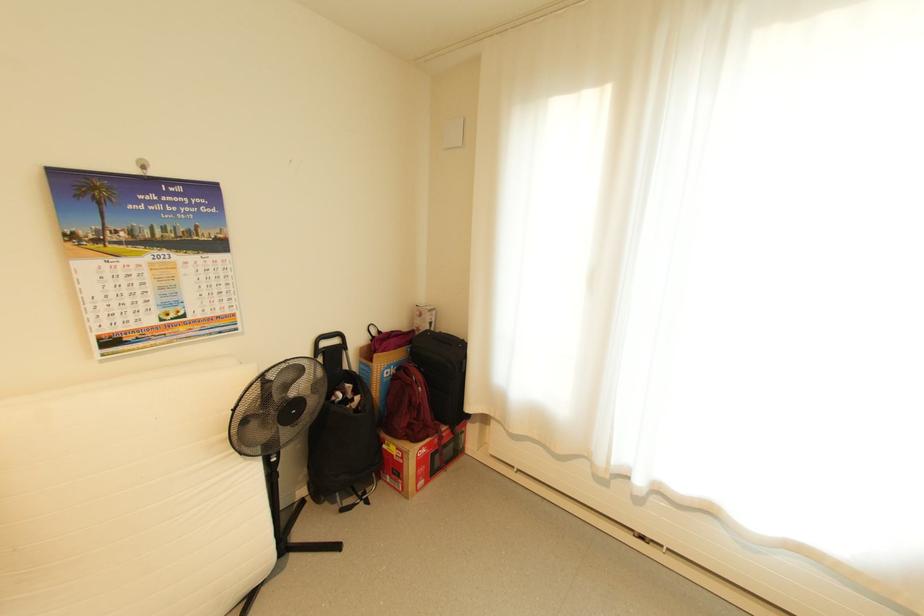
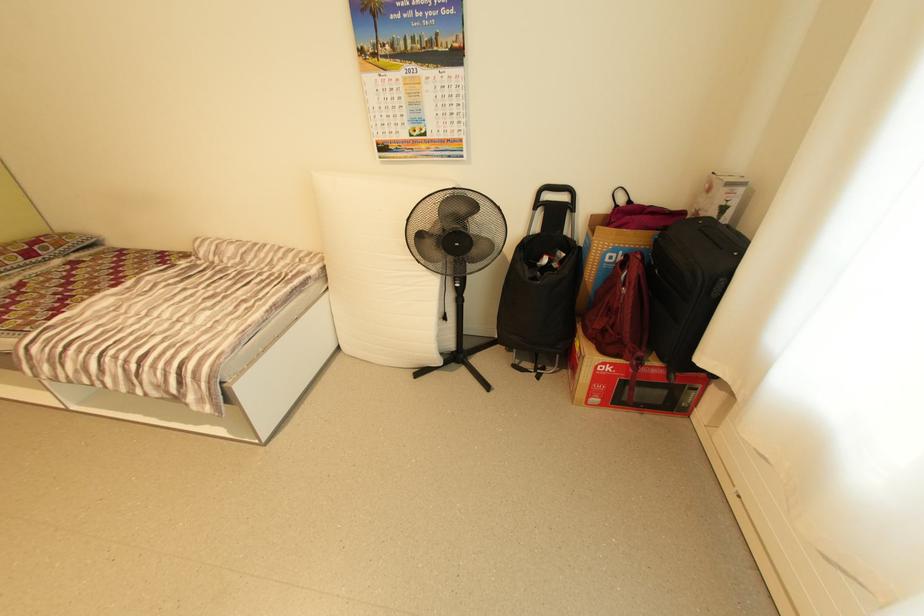
The point at (342, 342) is marked in the first image. Where is the corresponding point in the second image?

(570, 198)